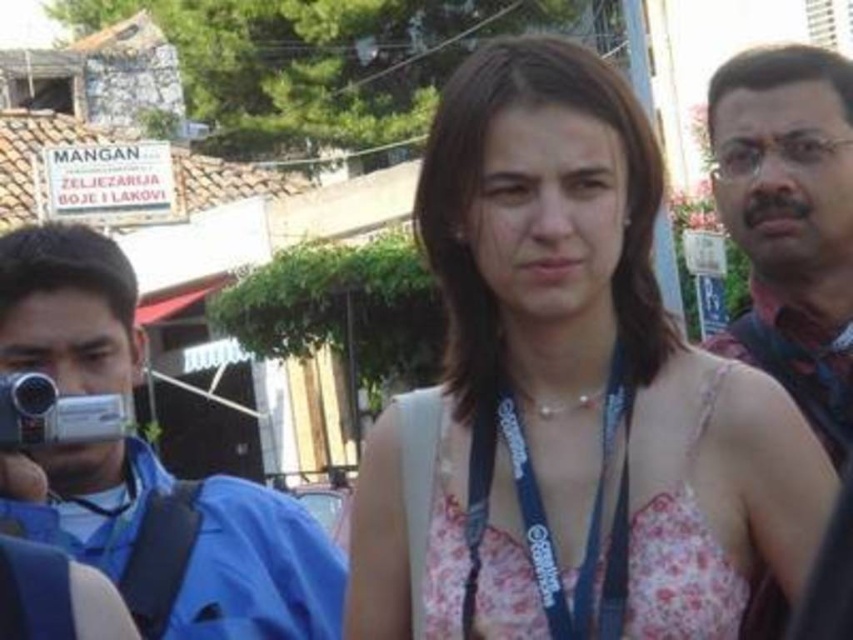
You are standing in the scene and want to move from the point at coordinates point (474, 141) to the point at coordinates point (480, 504). Which direction should you face to walk towards the second point?

Since point (474, 141) is closer to you than point (480, 504), you should face away from yourself towards point (480, 504) to walk towards it.

You are standing at the scene and want to take a closer look at the white floral dress at center. Given that the average walking speed is 3 feet per second, how many seconds will it take to reach the dress?

The white floral dress at center is 96.04 feet away from the viewer. At an average walking speed of 3 feet per second, it would take approximately 32 seconds to reach the dress.

Based on the photo, you are a photographer trying to capture a group photo. You notice the brown textured shirt at right and the silver metallic camera at left in your frame. Which object should you adjust to ensure both are fully visible in the photo?

The brown textured shirt at right might be wider than silver metallic camera at left, so you should adjust the frame to accommodate the width of the brown textured shirt at right to ensure both are fully visible.